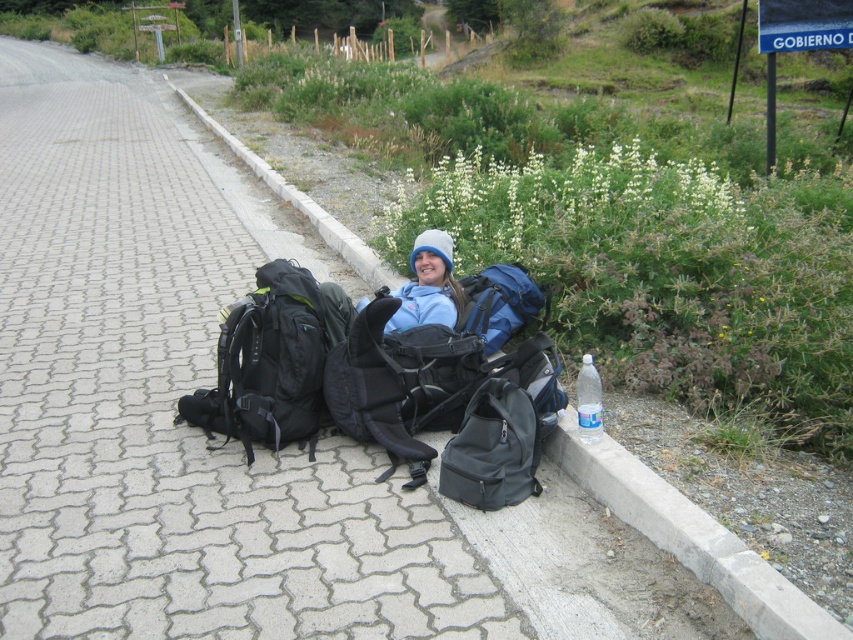
You are a hiker who just finished a long trek and need to set up your tent. You have a blue fabric backpack at center and a concrete at lower center. Which object can you use to weigh down the tent flaps against the wind?

The concrete at lower center can be used to weigh down the tent flaps because it is heavier than the blue fabric backpack at center.

You are packing for a hike and have a blue fleece jacket at center and a black matte backpack at center. Which item can hold more items?

The black matte backpack at center is larger in size than the blue fleece jacket at center, so it can hold more items.

You are a hiker who wants to place your black fabric backpack at center on the ground. Can you put it directly on the paved stone pavement at center without it being obstructed by any objects?

The paved stone pavement at center is closer to the viewer than the black fabric backpack at center, so the backpack is behind the pavement. Therefore, placing the backpack directly on the pavement would not be obstructed by any objects as there are no objects mentioned in front of the pavement.